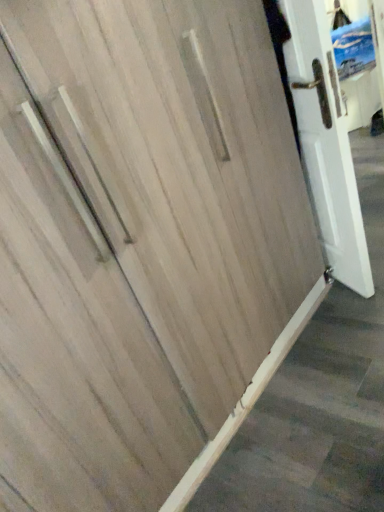
Image resolution: width=384 pixels, height=512 pixels. What do you see at coordinates (326, 143) in the screenshot? I see `white glossy door at upper right` at bounding box center [326, 143].

This screenshot has height=512, width=384. Find the location of `white glossy door at upper right`. white glossy door at upper right is located at coordinates (326, 143).

I want to click on white glossy door at upper right, so click(326, 143).